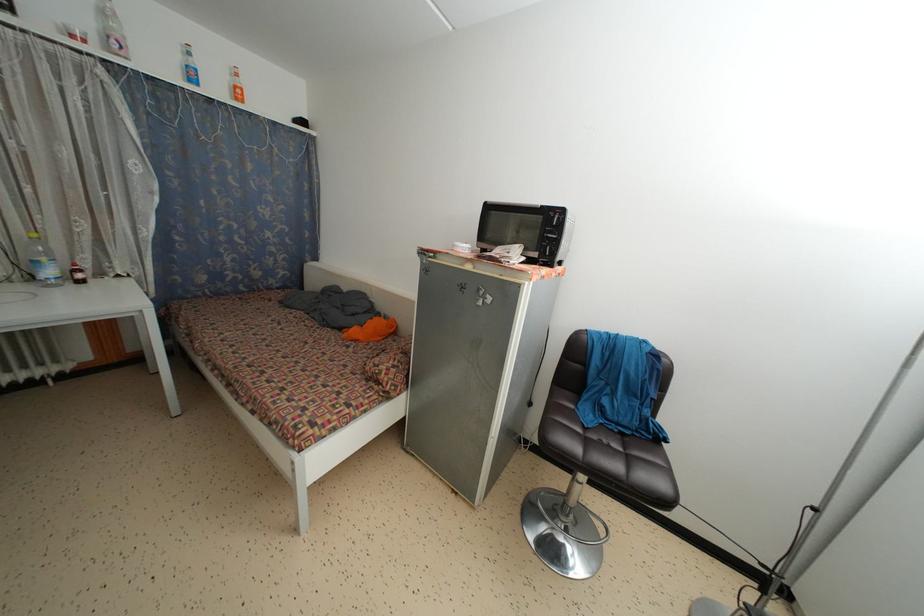
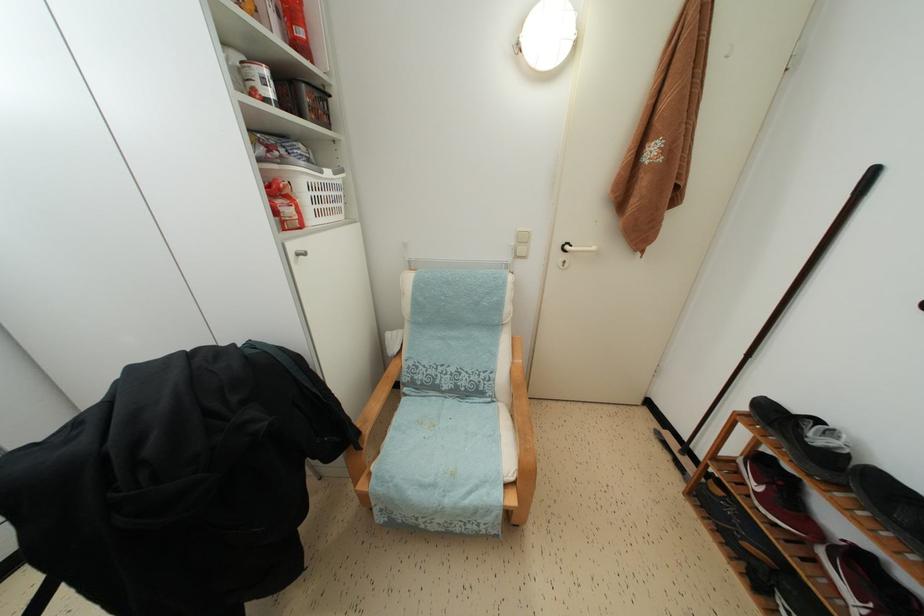
The first image is from the beginning of the video and the second image is from the end. How did the camera likely rotate when shooting the video?

The camera rotated toward right-down.